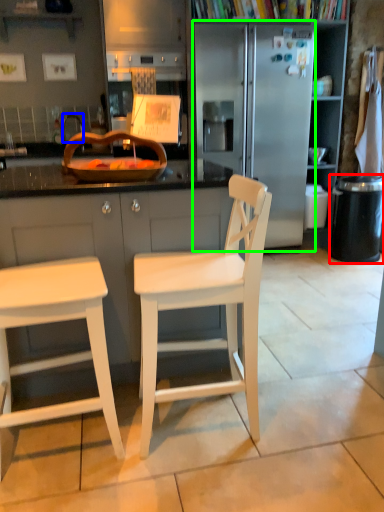
Question: Based on their relative distances, which object is nearer to trash bin/can (highlighted by a red box)? Choose from faucet (highlighted by a blue box) and refrigerator (highlighted by a green box).

Choices:
 (A) faucet
 (B) refrigerator

Answer: (B)